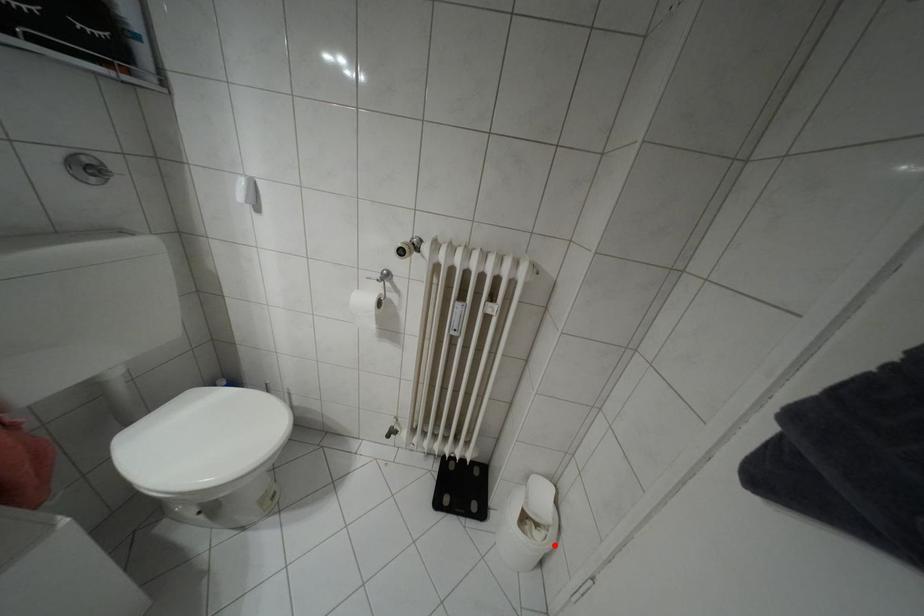
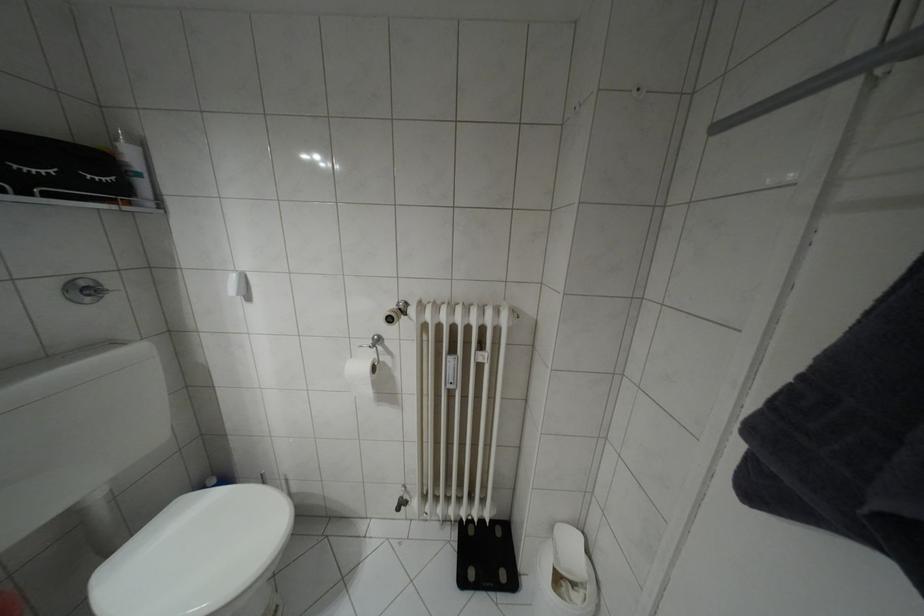
Find the pixel in the second image that matches the highlighted location in the first image.

(598, 606)